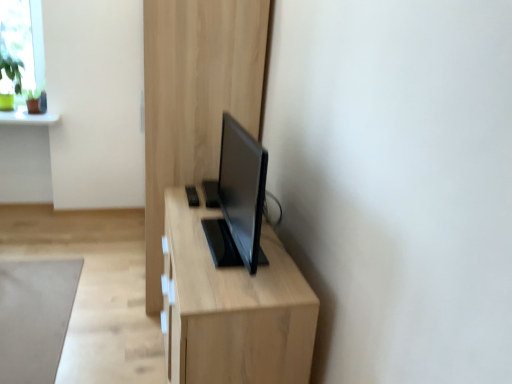
Image resolution: width=512 pixels, height=384 pixels. What are the coordinates of `free point above gray matte rug at lower left (from a real-world perspective)` in the screenshot? It's located at (27, 307).